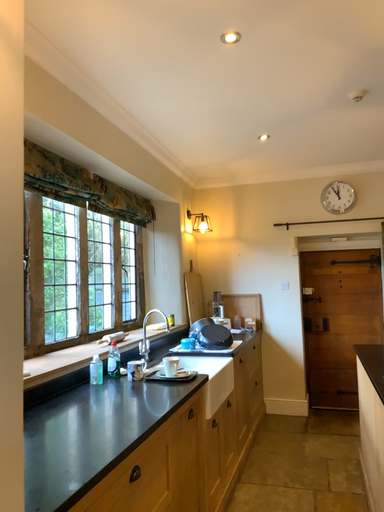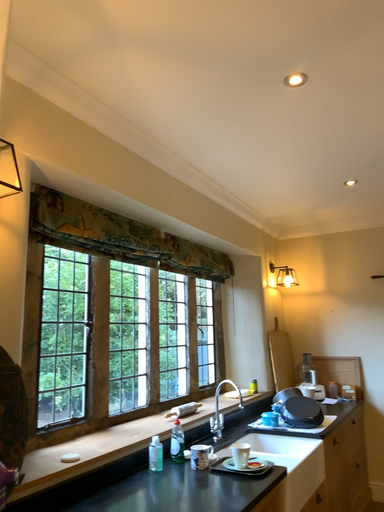
Question: How did the camera likely rotate when shooting the video?

Choices:
 (A) rotated downward
 (B) rotated upward

Answer: (B)